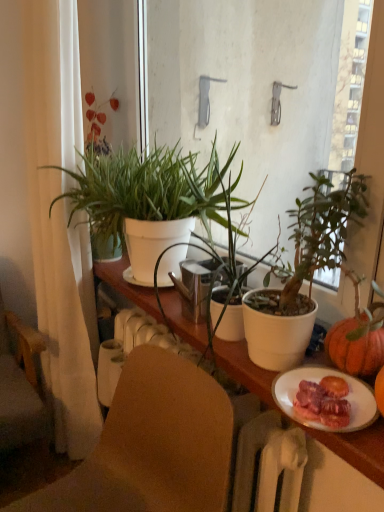
The height and width of the screenshot is (512, 384). Describe the element at coordinates (21, 401) in the screenshot. I see `wooden chair at left, the second chair viewed from the right` at that location.

This screenshot has height=512, width=384. Identify the location of white matte cabinet at center. (358, 449).

Locate an element on the screen. green matte plant at center, which is counted as the first houseplant, starting from the front is located at coordinates (219, 213).

Measure the distance between point (x=319, y=370) and camera.

Point (x=319, y=370) is 89.70 centimeters away from camera.

The width and height of the screenshot is (384, 512). I want to click on white matte plant pot at center, which is counted as the 2th houseplant, starting from the front, so (x=151, y=190).

I want to click on wooden chair at left, the second chair viewed from the right, so click(21, 401).

Can you confirm if wooden chair at left, the 2th chair when ordered from front to back, is smaller than brown fabric chair at lower center, arranged as the 1th chair when viewed from the front?

Yes.

From the image's perspective, is wooden chair at left, the first chair from the back, on top of brown fabric chair at lower center, positioned as the second chair in left-to-right order?

Yes, from the image's perspective, wooden chair at left, the first chair from the back, is above brown fabric chair at lower center, positioned as the second chair in left-to-right order.

In terms of width, does wooden chair at left, the first chair from the back, look wider or thinner when compared to brown fabric chair at lower center, positioned as the second chair in left-to-right order?

In the image, wooden chair at left, the first chair from the back, appears to be wider than brown fabric chair at lower center, positioned as the second chair in left-to-right order.

Does point (29, 360) come behind point (84, 490)?

Yes, it is.

From a real-world perspective, between wooden chair at left, the first chair from the back, and green matte plant at center, which is the 2th houseplant in back-to-front order, who is vertically higher?

green matte plant at center, which is the 2th houseplant in back-to-front order.

Can green matte plant at center, which is the 2th houseplant in back-to-front order, be found inside wooden chair at left, the 1th chair from the left?

That's incorrect, green matte plant at center, which is the 2th houseplant in back-to-front order, is not inside wooden chair at left, the 1th chair from the left.

Is wooden chair at left, the 2th chair when ordered from front to back, bigger than green matte plant at center, which is the 2th houseplant in back-to-front order?

Correct, wooden chair at left, the 2th chair when ordered from front to back, is larger in size than green matte plant at center, which is the 2th houseplant in back-to-front order.

In the scene shown: Is wooden chair at left, the 2th chair when ordered from front to back, oriented towards green matte plant at center, which is counted as the first houseplant, starting from the front?

No, wooden chair at left, the 2th chair when ordered from front to back, is not oriented towards green matte plant at center, which is counted as the first houseplant, starting from the front.

Can you tell me how much wooden chair at left, the first chair from the back, and white ceramic plate at lower right differ in facing direction?

90.3 degrees separate the facing orientations of wooden chair at left, the first chair from the back, and white ceramic plate at lower right.

From a real-world perspective, is wooden chair at left, the 2th chair when ordered from front to back, over white ceramic plate at lower right?

Incorrect, from a real-world perspective, wooden chair at left, the 2th chair when ordered from front to back, is lower than white ceramic plate at lower right.

Is wooden chair at left, the first chair from the back, wider or thinner than white ceramic plate at lower right?

Considering their sizes, wooden chair at left, the first chair from the back, looks broader than white ceramic plate at lower right.

Can you confirm if white matte plant pot at center, which is counted as the 2th houseplant, starting from the front, is positioned to the left of white ceramic plate at lower right?

Yes.

Can you confirm if white matte plant pot at center, positioned as the first houseplant in back-to-front order, is bigger than white ceramic plate at lower right?

Yes.

Based on the photo, from the image's perspective, between white matte plant pot at center, positioned as the first houseplant in back-to-front order, and white ceramic plate at lower right, who is located below?

white ceramic plate at lower right is shown below in the image.

Is white matte plant pot at center, which is counted as the 2th houseplant, starting from the front, far away from white ceramic plate at lower right?

No.

This screenshot has height=512, width=384. I want to click on curtain behind the brown fabric chair at lower center, arranged as the 1th chair when viewed from the front, so click(x=60, y=223).

Is white fabric curtain at left in contact with brown fabric chair at lower center, the first chair positioned from the right?

No, white fabric curtain at left is not making contact with brown fabric chair at lower center, the first chair positioned from the right.

From the image's perspective, is white fabric curtain at left below brown fabric chair at lower center, the first chair positioned from the right?

No.

What's the angular difference between white fabric curtain at left and white matte plant pot at center, which is counted as the 2th houseplant, starting from the front,'s facing directions?

0.318 degrees.

Does white fabric curtain at left have a larger size compared to white matte plant pot at center, which is counted as the 2th houseplant, starting from the front?

Yes, white fabric curtain at left is bigger than white matte plant pot at center, which is counted as the 2th houseplant, starting from the front.

Is white fabric curtain at left next to white matte plant pot at center, positioned as the first houseplant in back-to-front order, and touching it?

They are not placed beside each other.

Does white ceramic plate at lower right touch brown fabric chair at lower center, arranged as the 1th chair when viewed from the front?

white ceramic plate at lower right and brown fabric chair at lower center, arranged as the 1th chair when viewed from the front, are not in contact.

Which object is closer to the camera, white ceramic plate at lower right or brown fabric chair at lower center, the first chair positioned from the right?

brown fabric chair at lower center, the first chair positioned from the right, is in front.

Can you confirm if white ceramic plate at lower right is smaller than brown fabric chair at lower center, which is the 2th chair in back-to-front order?

Indeed, white ceramic plate at lower right has a smaller size compared to brown fabric chair at lower center, which is the 2th chair in back-to-front order.

Considering the sizes of objects white ceramic plate at lower right and brown fabric chair at lower center, the first chair positioned from the right, in the image provided, who is shorter, white ceramic plate at lower right or brown fabric chair at lower center, the first chair positioned from the right,?

white ceramic plate at lower right.

Find the location of `chair that is above the wooden chair at left, the second chair viewed from the right (from a real-world perspective)`. chair that is above the wooden chair at left, the second chair viewed from the right (from a real-world perspective) is located at coordinates coord(152,445).

Identify the location of chair that is the 2nd one below the green matte plant at center, which is the 2th houseplant in back-to-front order (from a real-world perspective). (21, 401).

Estimate the real-world distances between objects in this image. Which object is closer to white ceramic plate at lower right, brown fabric chair at lower center, which is the 2th chair in back-to-front order, or green matte plant at center, which is counted as the first houseplant, starting from the front?

The object closer to white ceramic plate at lower right is brown fabric chair at lower center, which is the 2th chair in back-to-front order.

Estimate the real-world distances between objects in this image. Which object is further from white matte cabinet at center, white matte plant pot at center, positioned as the first houseplant in back-to-front order, or wooden chair at left, the 1th chair from the left?

Among the two, wooden chair at left, the 1th chair from the left, is located further to white matte cabinet at center.

Looking at this image, looking at the image, which one is located further to white ceramic plate at lower right, green matte plant at center, which is the 2th houseplant in back-to-front order, or white fabric curtain at left?

white fabric curtain at left is positioned further to the anchor white ceramic plate at lower right.

Considering their positions, is white matte plant pot at center, which is counted as the 2th houseplant, starting from the front, positioned further to green matte plant at center, which is counted as the first houseplant, starting from the front, than brown fabric chair at lower center, the first chair positioned from the right?

brown fabric chair at lower center, the first chair positioned from the right, is positioned further to the anchor green matte plant at center, which is counted as the first houseplant, starting from the front.

Based on the photo, which object lies nearer to the anchor point green matte plant at center, which is counted as the first houseplant, starting from the front, wooden chair at left, the 1th chair from the left, or white fabric curtain at left?

white fabric curtain at left.

From the image, which object appears to be farther from brown fabric chair at lower center, positioned as the second chair in left-to-right order, white matte cabinet at center or white ceramic plate at lower right?

white ceramic plate at lower right is positioned further to the anchor brown fabric chair at lower center, positioned as the second chair in left-to-right order.

From the image, which object appears to be nearer to white ceramic plate at lower right, green matte plant at center, which is counted as the first houseplant, starting from the front, or white matte cabinet at center?

white matte cabinet at center is positioned closer to the anchor white ceramic plate at lower right.

Which object lies nearer to the anchor point brown fabric chair at lower center, positioned as the second chair in left-to-right order, green matte plant at center, which is the 2th houseplant in back-to-front order, or white matte cabinet at center?

Based on the image, white matte cabinet at center appears to be nearer to brown fabric chair at lower center, positioned as the second chair in left-to-right order.

I want to click on houseplant between wooden chair at left, the 1th chair from the left, and white matte cabinet at center, in the horizontal direction, so click(x=151, y=190).

Find the location of `chair between white matte plant pot at center, which is counted as the 2th houseplant, starting from the front, and brown fabric chair at lower center, the first chair positioned from the right, in the up-down direction`. chair between white matte plant pot at center, which is counted as the 2th houseplant, starting from the front, and brown fabric chair at lower center, the first chair positioned from the right, in the up-down direction is located at coordinates (21, 401).

Locate an element on the screen. chair between wooden chair at left, the 1th chair from the left, and green matte plant at center, which is counted as the first houseplant, starting from the front, in the horizontal direction is located at coordinates (152, 445).

Image resolution: width=384 pixels, height=512 pixels. I want to click on chair located between wooden chair at left, the second chair viewed from the right, and white ceramic plate at lower right in the left-right direction, so click(x=152, y=445).